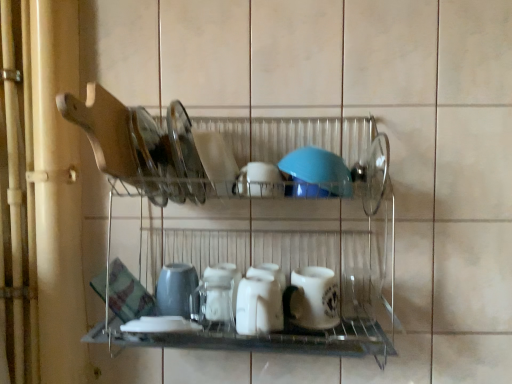
At what (x,y) coordinates should I click in order to perform the action: click on white glossy pitcher at center, which is counted as the 4th tableware, starting from the right. Please return your answer as a coordinate pair (x, y). This screenshot has height=384, width=512. Looking at the image, I should click on (254, 304).

Locate an element on the screen. The width and height of the screenshot is (512, 384). clear glass dishes at upper center is located at coordinates (279, 264).

At what (x,y) coordinates should I click in order to perform the action: click on white matte mug at center, placed as the 2th tableware when sorted from right to left. Please return your answer as a coordinate pair (x, y). Looking at the image, I should click on (314, 298).

The height and width of the screenshot is (384, 512). In order to click on matte gray cup at center in this screenshot , I will do `click(175, 289)`.

What do you see at coordinates (175, 289) in the screenshot?
I see `matte gray cup at center` at bounding box center [175, 289].

Where is `white glossy bowl at center, which ranks as the 3th tableware in right-to-left order`? This screenshot has height=384, width=512. white glossy bowl at center, which ranks as the 3th tableware in right-to-left order is located at coordinates (259, 181).

From a real-world perspective, which object rests below the other?

white matte mug at center, placed as the 2th tableware when sorted from right to left, from a real-world perspective.

Looking at this image, is white matte mug at center, positioned as the 5th tableware in left-to-right order, completely or partially inside matte gray cup at center?

No, white matte mug at center, positioned as the 5th tableware in left-to-right order, is not surrounded by matte gray cup at center.

Is matte gray cup at center facing towards white matte mug at center, positioned as the 5th tableware in left-to-right order?

No, matte gray cup at center does not turn towards white matte mug at center, positioned as the 5th tableware in left-to-right order.

How different are the orientations of matte gray cup at center and white matte mug at center, positioned as the 5th tableware in left-to-right order, in degrees?

There is a 1.18-degree angle between the facing directions of matte gray cup at center and white matte mug at center, positioned as the 5th tableware in left-to-right order.

Which object is positioned more to the right, white glossy bowl at center, which is counted as the fifth tableware, starting from the right, or white glossy pitcher at center, which is counted as the third tableware, starting from the left?

white glossy pitcher at center, which is counted as the third tableware, starting from the left.

Is white glossy bowl at center, the 2th tableware when ordered from left to right, taller than white glossy pitcher at center, which is counted as the third tableware, starting from the left?

Correct, white glossy bowl at center, the 2th tableware when ordered from left to right, is much taller as white glossy pitcher at center, which is counted as the third tableware, starting from the left.

From the image's perspective, who appears lower, white glossy bowl at center, the 2th tableware when ordered from left to right, or white glossy pitcher at center, which is counted as the third tableware, starting from the left?

white glossy pitcher at center, which is counted as the third tableware, starting from the left, appears lower in the image.

Does matte gray cup at center have a larger size compared to clear glass dishes at upper center?

No.

Which of these two, matte gray cup at center or clear glass dishes at upper center, stands shorter?

matte gray cup at center.

Is matte gray cup at center positioned with its back to clear glass dishes at upper center?

Correct, matte gray cup at center is looking away from clear glass dishes at upper center.

From a real-world perspective, is blue rubber lid at center, which appears as the 6th tableware when viewed from the left, under white glossy bowl at center, which is counted as the fifth tableware, starting from the right?

Indeed, from a real-world perspective, blue rubber lid at center, which appears as the 6th tableware when viewed from the left, is positioned beneath white glossy bowl at center, which is counted as the fifth tableware, starting from the right.

From their relative heights in the image, would you say blue rubber lid at center, which appears as the 6th tableware when viewed from the left, is taller or shorter than white glossy bowl at center, the 2th tableware when ordered from left to right?

In the image, blue rubber lid at center, which appears as the 6th tableware when viewed from the left, appears to be shorter than white glossy bowl at center, the 2th tableware when ordered from left to right.

Does blue rubber lid at center, the 1th tableware positioned from the right, have a greater width compared to white glossy bowl at center, the 2th tableware when ordered from left to right?

In fact, blue rubber lid at center, the 1th tableware positioned from the right, might be narrower than white glossy bowl at center, the 2th tableware when ordered from left to right.

From the picture: Is the position of white glossy pitcher at center, which is counted as the third tableware, starting from the left, less distant than that of white glossy bowl at center, which ranks as the 3th tableware in right-to-left order?

That is True.

Considering the points (264, 331) and (274, 186), which point is behind, point (264, 331) or point (274, 186)?

The point (274, 186) is farther.

How distant is white glossy pitcher at center, which is counted as the third tableware, starting from the left, from white glossy bowl at center, acting as the 4th tableware starting from the left?

white glossy pitcher at center, which is counted as the third tableware, starting from the left, and white glossy bowl at center, acting as the 4th tableware starting from the left, are 7.68 inches apart from each other.

Consider the image. Is white glossy pitcher at center, which is counted as the 4th tableware, starting from the right, turned away from white glossy bowl at center, acting as the 4th tableware starting from the left?

No, white glossy pitcher at center, which is counted as the 4th tableware, starting from the right, is not facing away from white glossy bowl at center, acting as the 4th tableware starting from the left.

Can you tell me how much clear glass dishes at upper center and white glossy pitcher at center, which is counted as the 4th tableware, starting from the right, differ in facing direction?

3.41 degrees separate the facing orientations of clear glass dishes at upper center and white glossy pitcher at center, which is counted as the 4th tableware, starting from the right.

Does clear glass dishes at upper center turn towards white glossy pitcher at center, which is counted as the 4th tableware, starting from the right?

Yes, clear glass dishes at upper center faces towards white glossy pitcher at center, which is counted as the 4th tableware, starting from the right.

Between point (207, 216) and point (255, 309), which one is positioned behind?

The point (207, 216) is more distant.

Considering the relative sizes of clear glass dishes at upper center and white glossy pitcher at center, which is counted as the 4th tableware, starting from the right, in the image provided, is clear glass dishes at upper center taller than white glossy pitcher at center, which is counted as the 4th tableware, starting from the right,?

Correct, clear glass dishes at upper center is much taller as white glossy pitcher at center, which is counted as the 4th tableware, starting from the right.

What's the angular difference between blue rubber lid at center, which appears as the 6th tableware when viewed from the left, and white glossy pitcher at center, which is counted as the 4th tableware, starting from the right,'s facing directions?

7.02 degrees separate the facing orientations of blue rubber lid at center, which appears as the 6th tableware when viewed from the left, and white glossy pitcher at center, which is counted as the 4th tableware, starting from the right.

Which is more to the left, blue rubber lid at center, the 1th tableware positioned from the right, or white glossy pitcher at center, which is counted as the third tableware, starting from the left?

white glossy pitcher at center, which is counted as the third tableware, starting from the left.

Considering their positions, is blue rubber lid at center, the 1th tableware positioned from the right, located in front of or behind white glossy pitcher at center, which is counted as the third tableware, starting from the left?

In the image, blue rubber lid at center, the 1th tableware positioned from the right, appears behind white glossy pitcher at center, which is counted as the third tableware, starting from the left.

From the image's perspective, which object appears higher, blue rubber lid at center, which appears as the 6th tableware when viewed from the left, or white glossy pitcher at center, which is counted as the 4th tableware, starting from the right?

blue rubber lid at center, which appears as the 6th tableware when viewed from the left, from the image's perspective.

This screenshot has width=512, height=384. I want to click on appliance behind the white matte mug at center, placed as the 2th tableware when sorted from right to left, so click(175, 289).

Locate an element on the screen. This screenshot has height=384, width=512. tableware that is the 3rd object located above the white glossy pitcher at center, which is counted as the 4th tableware, starting from the right (from the image's perspective) is located at coordinates (216, 161).

When comparing their distances from clear glass dishes at upper center, does blue rubber lid at center, the 1th tableware positioned from the right, or white glossy bowl at center, which ranks as the 3th tableware in right-to-left order, seem further?

white glossy bowl at center, which ranks as the 3th tableware in right-to-left order, lies further to clear glass dishes at upper center than the other object.

Based on their spatial positions, is matte gray cup at center or white glossy pitcher at center, which is counted as the 4th tableware, starting from the right, further from blue rubber lid at center, the 1th tableware positioned from the right?

matte gray cup at center lies further to blue rubber lid at center, the 1th tableware positioned from the right, than the other object.

Based on their spatial positions, is clear glass dishes at upper center or white glossy pitcher at center, which is counted as the 4th tableware, starting from the right, further from blue rubber lid at center, which appears as the 6th tableware when viewed from the left?

The object further to blue rubber lid at center, which appears as the 6th tableware when viewed from the left, is white glossy pitcher at center, which is counted as the 4th tableware, starting from the right.

Based on their spatial positions, is white glossy pitcher at center, which is counted as the 4th tableware, starting from the right, or clear glass plate at upper center, positioned as the 6th tableware in right-to-left order, further from white matte mug at center, placed as the 2th tableware when sorted from right to left?

Among the two, clear glass plate at upper center, positioned as the 6th tableware in right-to-left order, is located further to white matte mug at center, placed as the 2th tableware when sorted from right to left.

Considering their positions, is white glossy bowl at center, which ranks as the 3th tableware in right-to-left order, positioned closer to white glossy pitcher at center, which is counted as the third tableware, starting from the left, than white matte mug at center, positioned as the 5th tableware in left-to-right order?

white matte mug at center, positioned as the 5th tableware in left-to-right order.

Considering their positions, is white matte mug at center, placed as the 2th tableware when sorted from right to left, positioned further to blue rubber lid at center, which appears as the 6th tableware when viewed from the left, than clear glass dishes at upper center?

clear glass dishes at upper center is positioned further to the anchor blue rubber lid at center, which appears as the 6th tableware when viewed from the left.

Estimate the real-world distances between objects in this image. Which object is closer to clear glass dishes at upper center, white glossy pitcher at center, which is counted as the 4th tableware, starting from the right, or clear glass plate at upper center, positioned as the 6th tableware in right-to-left order?

Based on the image, white glossy pitcher at center, which is counted as the 4th tableware, starting from the right, appears to be nearer to clear glass dishes at upper center.

Looking at the image, which one is located closer to blue rubber lid at center, the 1th tableware positioned from the right, matte gray cup at center or white matte mug at center, placed as the 2th tableware when sorted from right to left?

white matte mug at center, placed as the 2th tableware when sorted from right to left, lies closer to blue rubber lid at center, the 1th tableware positioned from the right, than the other object.

This screenshot has height=384, width=512. In order to click on shelf between clear glass plate at upper center, positioned as the 6th tableware in right-to-left order, and white glossy pitcher at center, which is counted as the 4th tableware, starting from the right, in the up-down direction in this screenshot , I will do `click(279, 264)`.

I want to click on shelf between clear glass plate at upper center, the 1th tableware viewed from the left, and white glossy bowl at center, which ranks as the 3th tableware in right-to-left order, so click(x=279, y=264).

Where is `shelf between matte gray cup at center and white matte mug at center, positioned as the 5th tableware in left-to-right order, from left to right`? shelf between matte gray cup at center and white matte mug at center, positioned as the 5th tableware in left-to-right order, from left to right is located at coordinates 279,264.

You are a GUI agent. You are given a task and a screenshot of the screen. Output one action in this format:
    pyautogui.click(x=<x>, y=<y>)
    Task: Click on the appliance between white glossy bowl at center, the 2th tableware when ordered from left to right, and white glossy pitcher at center, which is counted as the 4th tableware, starting from the right, in the up-down direction
    This screenshot has height=384, width=512.
    Given the screenshot: What is the action you would take?
    pyautogui.click(x=175, y=289)